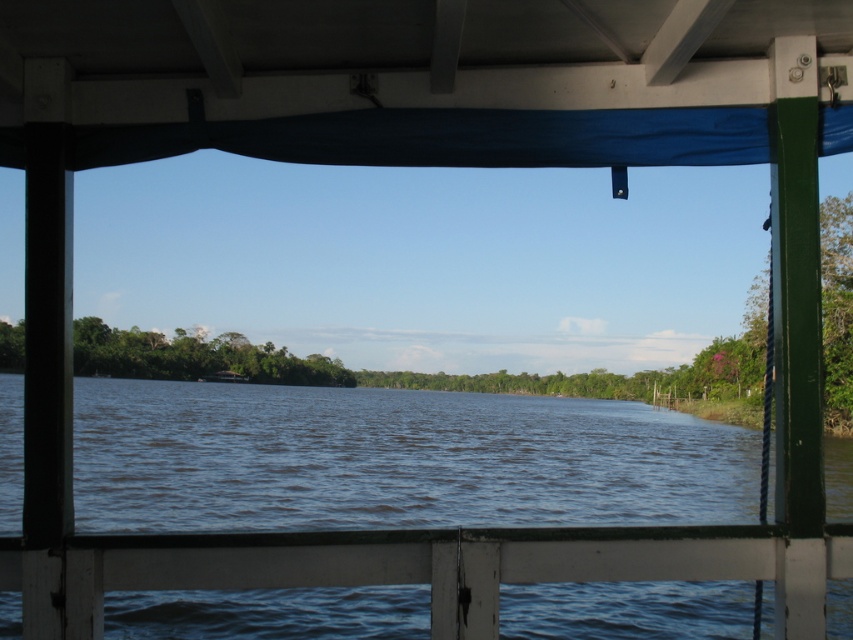
Is blue water at center thinner than white painted wood rail at lower center?

No.

Is blue water at center wider than white painted wood rail at lower center?

Yes, blue water at center is wider than white painted wood rail at lower center.

The height and width of the screenshot is (640, 853). In order to click on blue water at center in this screenshot , I will do `click(393, 460)`.

Where is `blue water at center`? blue water at center is located at coordinates (393, 460).